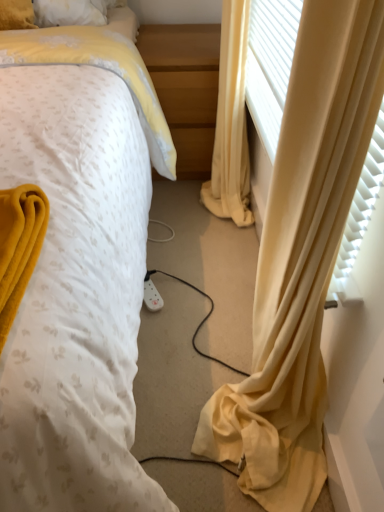
Question: Is yellow fabric curtain at right inside the boundaries of light wood/finely finished nightstand at center, or outside?

Choices:
 (A) inside
 (B) outside

Answer: (B)

Question: Is yellow fabric curtain at right in front of or behind light wood/finely finished nightstand at center in the image?

Choices:
 (A) behind
 (B) front

Answer: (B)

Question: Estimate the real-world distances between objects in this image. Which object is farther from the yellow fabric curtain at right?

Choices:
 (A) white dotted fabric at center
 (B) light wood/finely finished nightstand at center

Answer: (A)

Question: Which of these objects is positioned closest to the yellow fabric curtain at right?

Choices:
 (A) light wood/finely finished nightstand at center
 (B) white dotted fabric at center

Answer: (A)